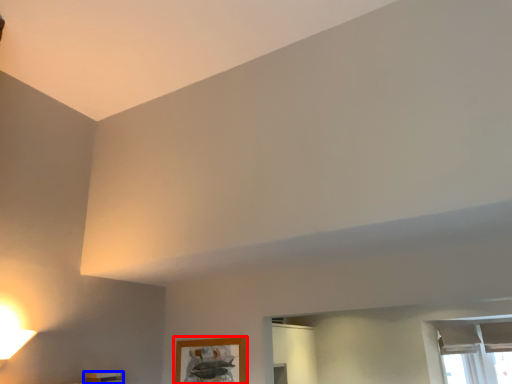
Question: Which object is further to the camera taking this photo, picture frame (highlighted by a red box) or furniture (highlighted by a blue box)?

Choices:
 (A) picture frame
 (B) furniture

Answer: (A)